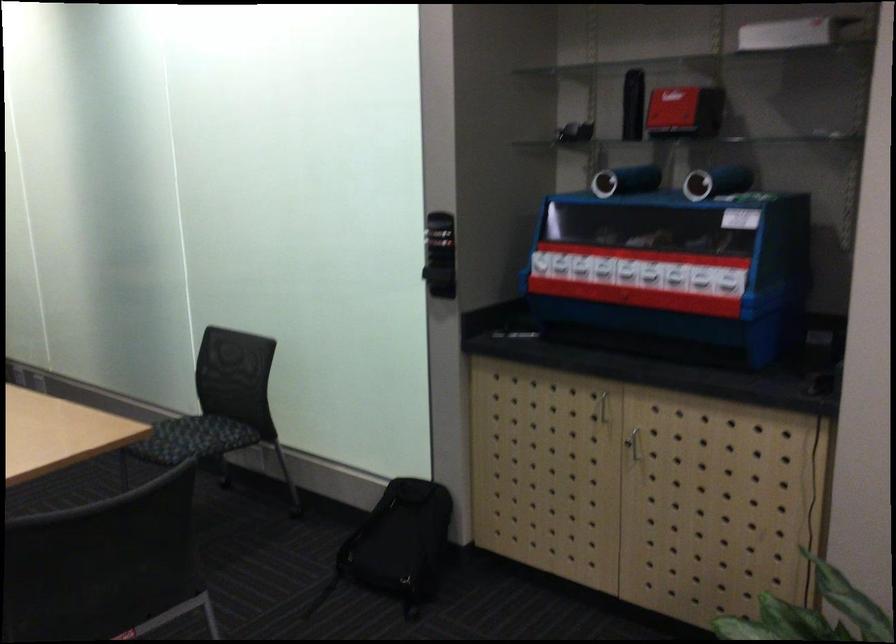
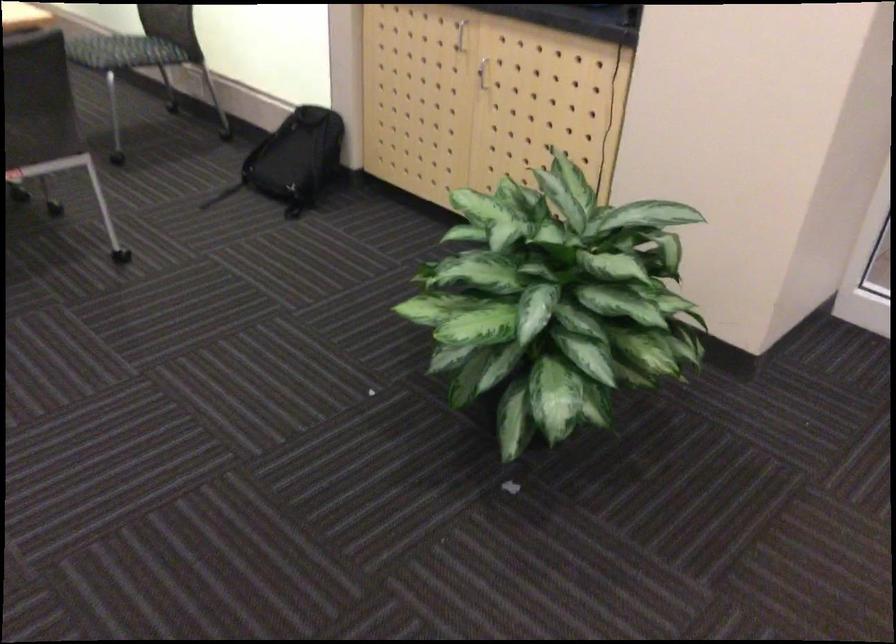
In the second image, find the point that corresponds to pixel 615 406 in the first image.

(460, 35)